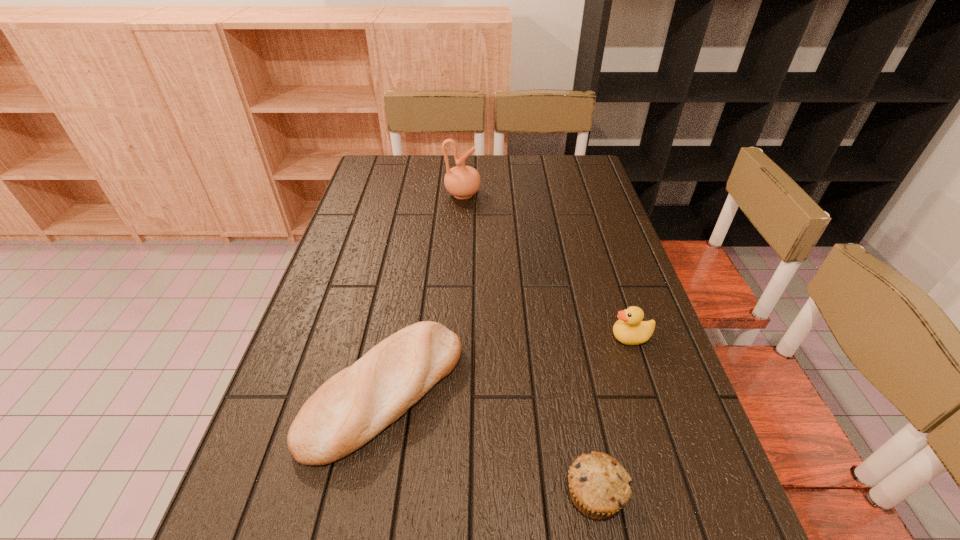
Where is `vacant space that satisfies the following two spatial constraints: 1. on the front side of the bread; 2. on the left side of the third object from left to right`? The image size is (960, 540). vacant space that satisfies the following two spatial constraints: 1. on the front side of the bread; 2. on the left side of the third object from left to right is located at coordinates (365, 494).

Identify the location of vacant space that satisfies the following two spatial constraints: 1. on the spout of the tallest object; 2. on the left side of the muffin. (446, 494).

I want to click on blank area in the image that satisfies the following two spatial constraints: 1. on the front side of the muffin; 2. on the right side of the bread, so click(365, 494).